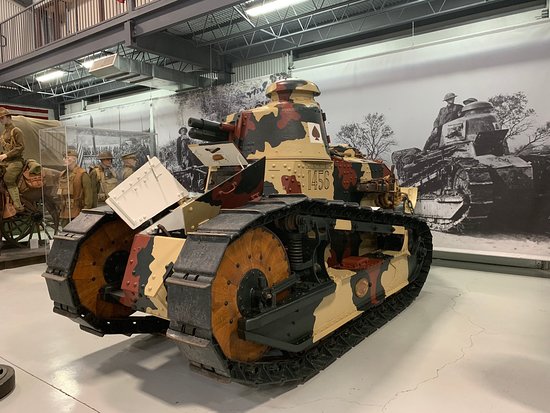
Locate an element on the screen. The width and height of the screenshot is (550, 413). floor is located at coordinates (480, 330), (424, 381), (18, 316).